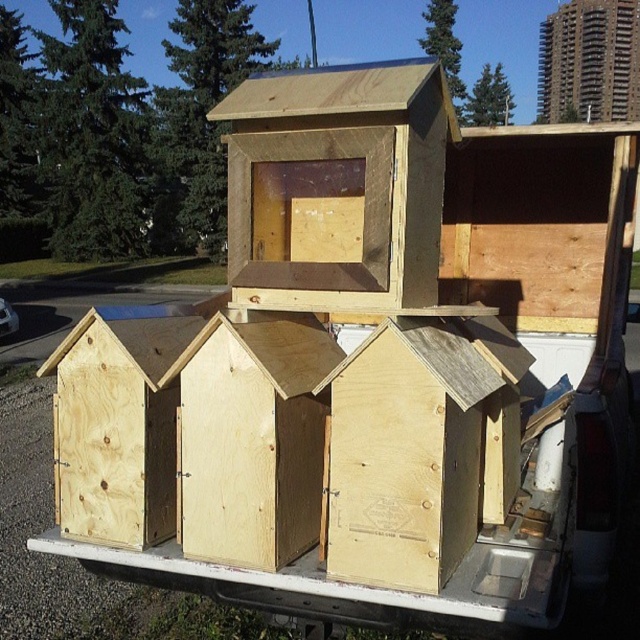
Question: Estimate the real-world distances between objects in this image. Which object is farther from the plywood hut at lower left?

Choices:
 (A) light brown wood birdhouse at center
 (B) matte wood birdhouse at upper center

Answer: (B)

Question: In this image, where is light brown wood birdhouse at center located relative to plywood hut at center?

Choices:
 (A) below
 (B) above

Answer: (A)

Question: Which object is positioned farthest from the plywood hut at center?

Choices:
 (A) light brown wood birdhouse at center
 (B) natural wood birdhouse at center

Answer: (A)

Question: Which is nearer to the natural wood birdhouse at center?

Choices:
 (A) matte wood birdhouse at upper center
 (B) plywood hut at center
 (C) light brown wood birdhouse at center
 (D) plywood hut at lower left

Answer: (B)

Question: Is natural wood birdhouse at center above matte wood birdhouse at upper center?

Choices:
 (A) yes
 (B) no

Answer: (B)

Question: Can you confirm if plywood hut at center is wider than plywood hut at lower left?

Choices:
 (A) no
 (B) yes

Answer: (B)